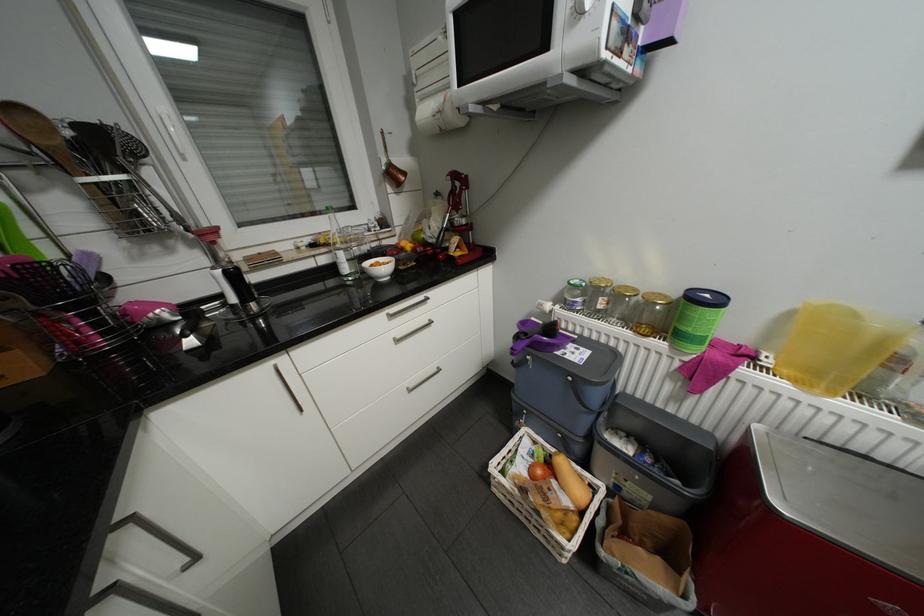
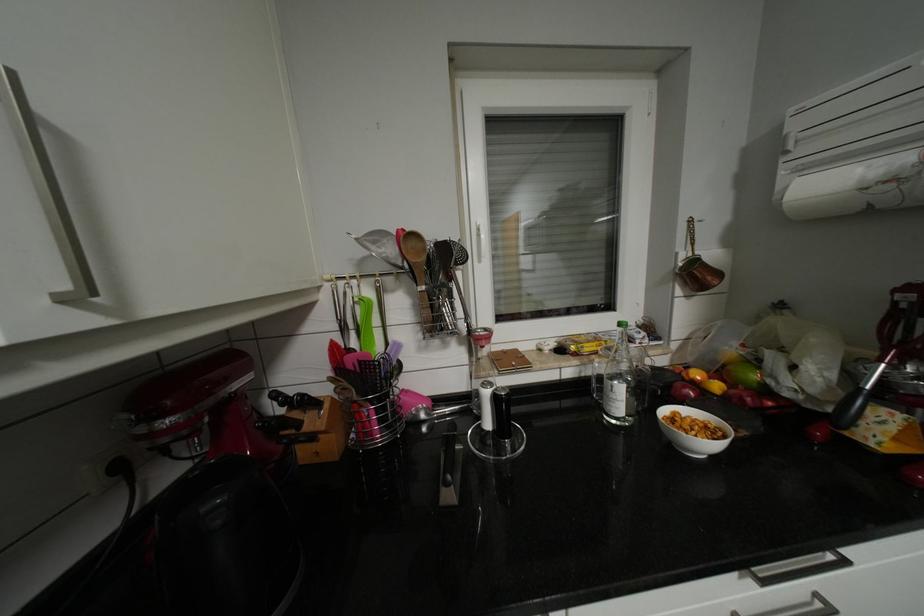
In the second image, find the point that corresponds to point 199,342 in the first image.

(456, 495)